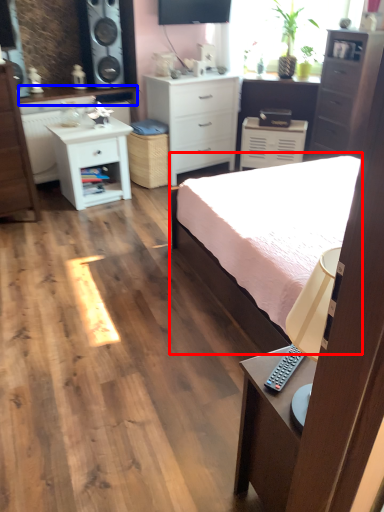
Question: Among these objects, which one is farthest to the camera, bed (highlighted by a red box) or counter top (highlighted by a blue box)?

Choices:
 (A) bed
 (B) counter top

Answer: (B)